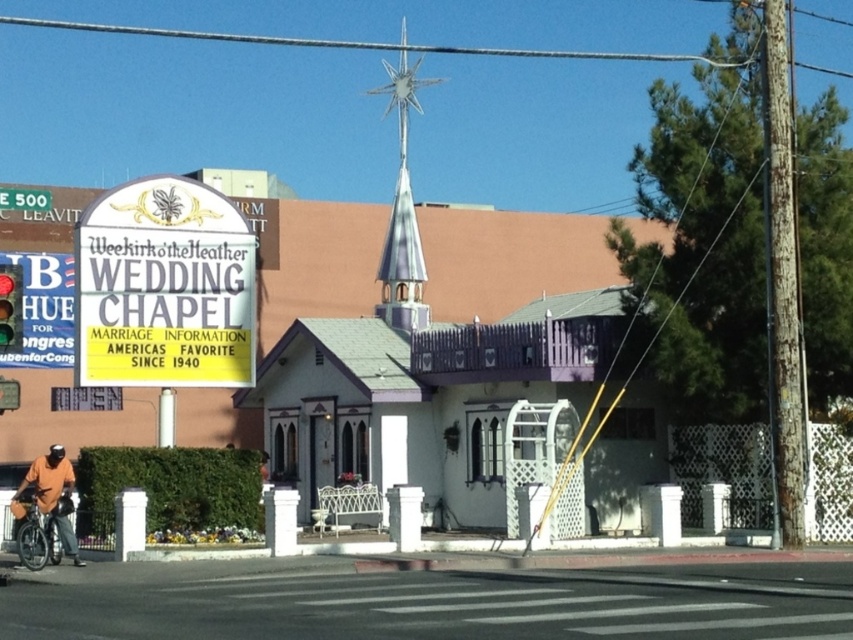
Question: Which object appears farthest from the camera in this image?

Choices:
 (A) white plastic sign at upper left
 (B) red glass traffic light at upper left

Answer: (A)

Question: Can you confirm if shiny silver spire at upper center is positioned below silver metallic bicycle at lower left?

Choices:
 (A) no
 (B) yes

Answer: (A)

Question: Estimate the real-world distances between objects in this image. Which object is farther from the shiny silver spire at upper center?

Choices:
 (A) silver metallic bicycle at lower left
 (B) white plastic sign at upper left
 (C) black asphalt at lower center
 (D) red glass traffic light at upper left

Answer: (D)

Question: Which object appears farthest from the camera in this image?

Choices:
 (A) white plastic sign at upper left
 (B) red glass traffic light at upper left

Answer: (A)

Question: Can you confirm if white plastic sign at upper left is positioned to the right of red glass traffic light at upper left?

Choices:
 (A) yes
 (B) no

Answer: (A)

Question: From the image, what is the correct spatial relationship of black asphalt at lower center in relation to red glass traffic light at upper left?

Choices:
 (A) right
 (B) left

Answer: (A)